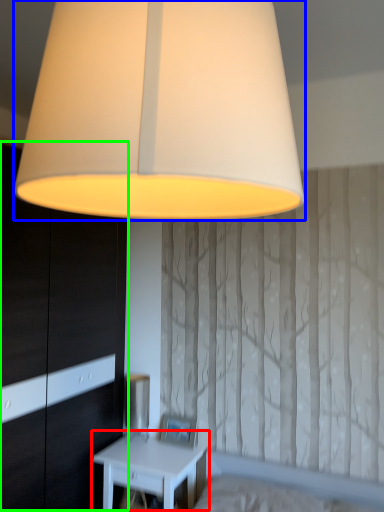
Question: Estimate the real-world distances between objects in this image. Which object is farther from nightstand (highlighted by a red box), lamp (highlighted by a blue box) or dresser (highlighted by a green box)?

Choices:
 (A) lamp
 (B) dresser

Answer: (A)